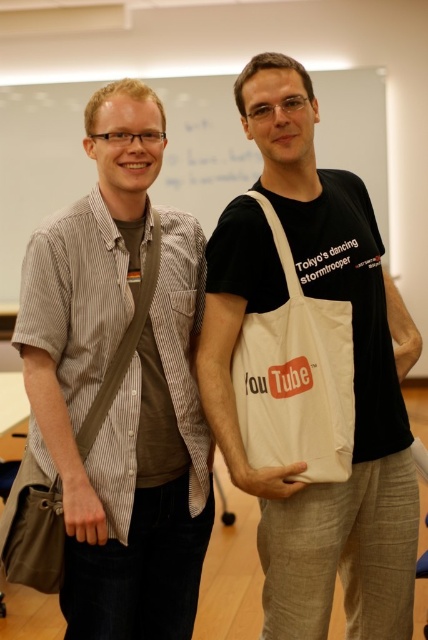
Question: Does white cotton tote bag at center appear on the right side of white canvas tote bag at center?

Choices:
 (A) yes
 (B) no

Answer: (B)

Question: Which point appears farthest from the camera in this image?

Choices:
 (A) (145, 486)
 (B) (299, 470)
 (C) (196, 198)
 (D) (296, 372)

Answer: (C)

Question: Where is striped cotton shirt at left located in relation to white canvas tote bag at center in the image?

Choices:
 (A) below
 (B) above

Answer: (A)

Question: Which point is closer to the camera?

Choices:
 (A) (213, 241)
 (B) (234, 129)
 (C) (311, 317)

Answer: (C)

Question: Does striped cotton shirt at left appear under white cotton tote bag at center?

Choices:
 (A) no
 (B) yes

Answer: (B)

Question: Estimate the real-world distances between objects in this image. Which object is farther from the striped cotton shirt at left?

Choices:
 (A) white cotton tote bag at center
 (B) white canvas tote bag at center

Answer: (B)